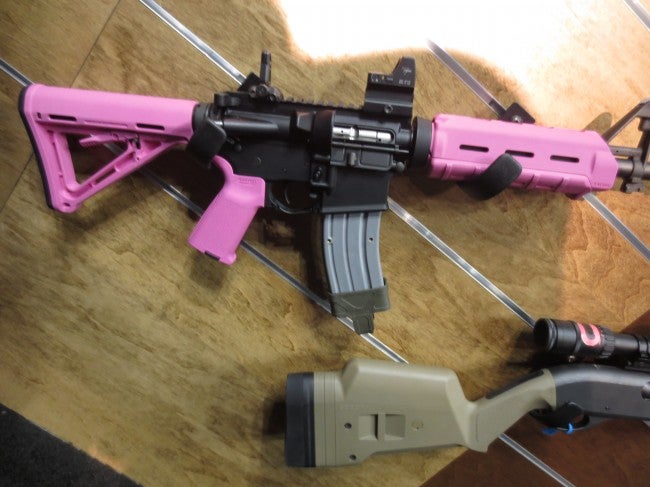
Where is `hooks`? This screenshot has height=487, width=650. hooks is located at coordinates (491, 177), (190, 147), (569, 414).